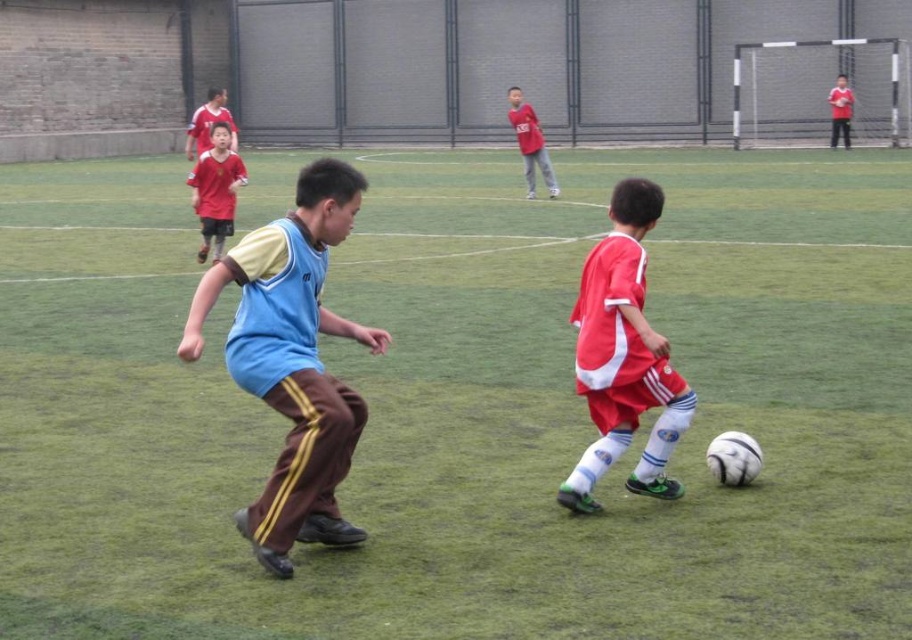
Question: Does red matte soccer player at center have a greater width compared to matte blue shirt at upper center?

Choices:
 (A) no
 (B) yes

Answer: (A)

Question: Based on their relative distances, which object is farther from the matte blue shirt at upper center?

Choices:
 (A) red matte soccer player at center
 (B) blue jersey at center
 (C) matte red jersey at center

Answer: (A)

Question: Estimate the real-world distances between objects in this image. Which object is farther from the red matte shirt at center?

Choices:
 (A) blue jersey at center
 (B) red matte soccer player at center

Answer: (A)

Question: Does blue jersey at center have a greater width compared to matte red jersey at center?

Choices:
 (A) yes
 (B) no

Answer: (A)

Question: Which of the following is the closest to the observer?

Choices:
 (A) red matte shirt at center
 (B) red matte soccer player at center
 (C) matte red jersey at center
 (D) blue jersey at center

Answer: (D)

Question: Is blue jersey at center below red matte soccer player at center?

Choices:
 (A) yes
 (B) no

Answer: (A)